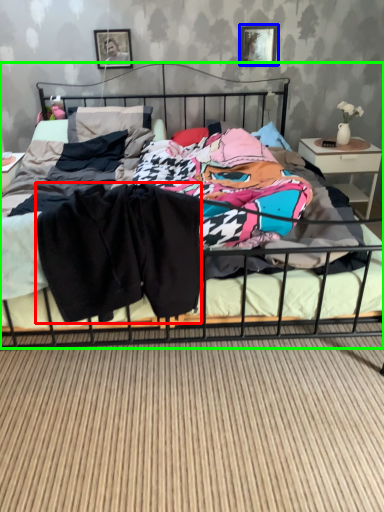
Question: Based on their relative distances, which object is farther from clothing (highlighted by a red box)? Choose from picture frame (highlighted by a blue box) and bed (highlighted by a green box).

Choices:
 (A) picture frame
 (B) bed

Answer: (A)